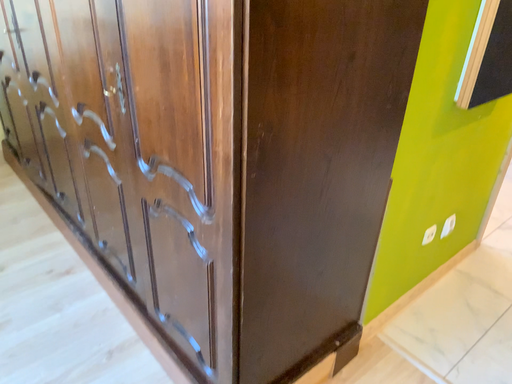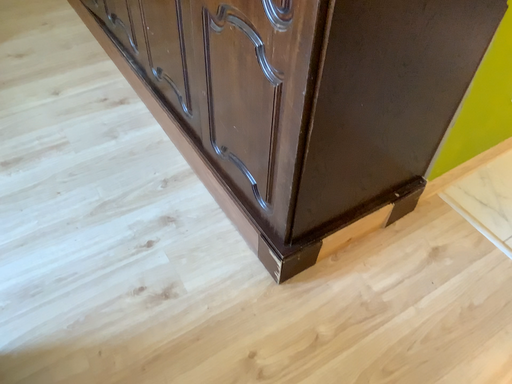
Question: How did the camera likely rotate when shooting the video?

Choices:
 (A) rotated right
 (B) rotated left

Answer: (B)